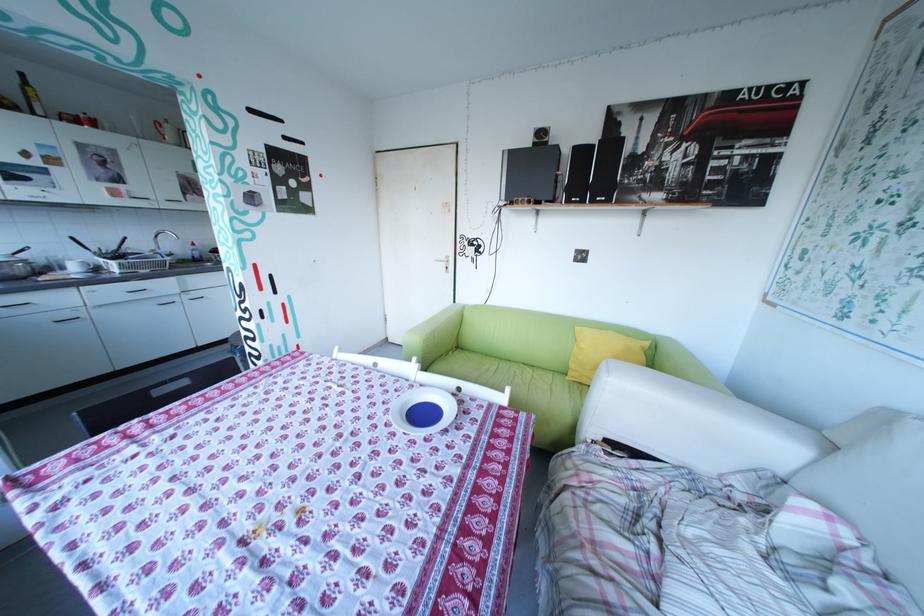
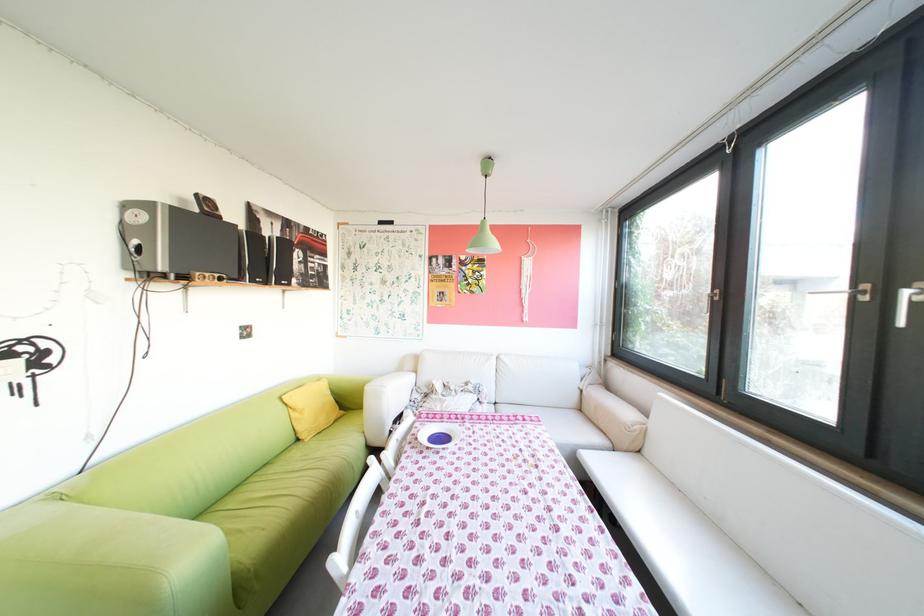
In the second image, find the point that corresponds to point (490, 490) in the first image.

(484, 419)